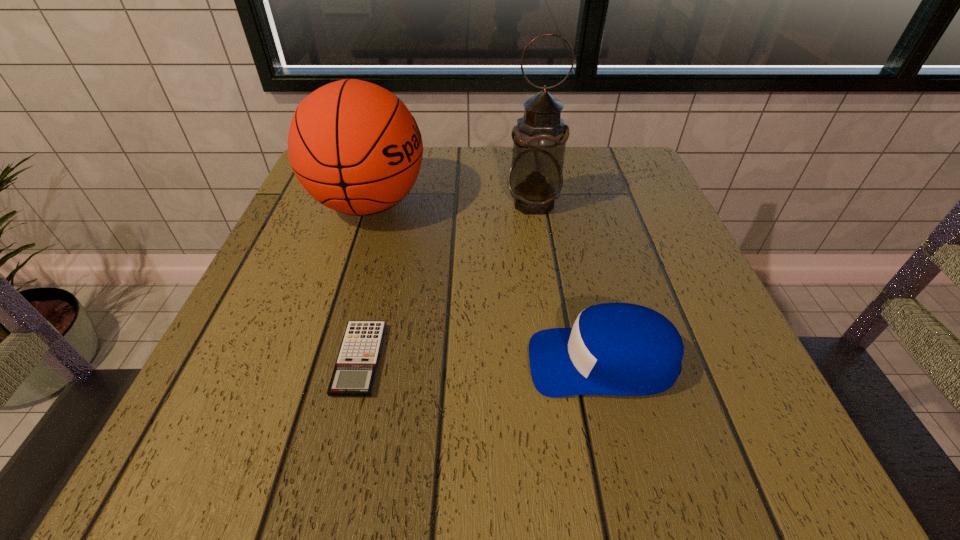
Locate an element on the screen. oil lamp that is positioned at the far edge is located at coordinates (535, 179).

Where is `basketball that is at the far edge`? This screenshot has width=960, height=540. basketball that is at the far edge is located at coordinates (354, 146).

I want to click on object positioned at the left edge, so click(354, 146).

Find the location of a particular element. object present at the right edge is located at coordinates (621, 349).

Identify the location of object that is at the far left corner. (354, 146).

Image resolution: width=960 pixels, height=540 pixels. What are the coordinates of `vacant space at the far edge` in the screenshot? It's located at (582, 191).

In the image, there is a desktop. At what (x,y) coordinates should I click in order to perform the action: click on vacant space at the near edge. Please return your answer as a coordinate pair (x, y). Looking at the image, I should click on (636, 429).

Locate an element on the screen. The height and width of the screenshot is (540, 960). free location at the left edge of the desktop is located at coordinates (238, 333).

In the image, there is a desktop. In order to click on vacant space at the right edge in this screenshot , I will do `click(698, 345)`.

Where is `free space at the near left corner of the desktop`? The width and height of the screenshot is (960, 540). free space at the near left corner of the desktop is located at coordinates (299, 437).